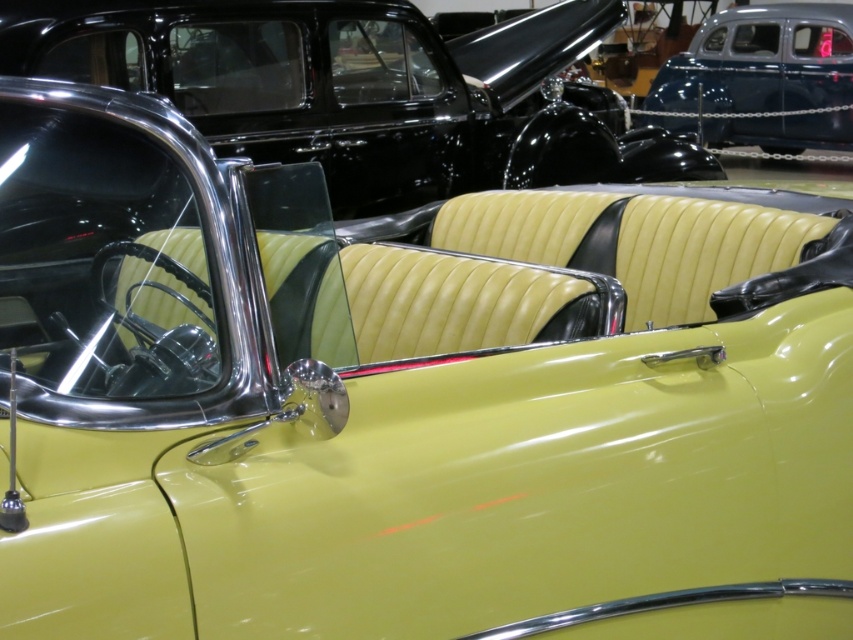
Question: Which point is farther to the camera?

Choices:
 (A) matte yellow leather car at center
 (B) matte blue car at upper right

Answer: (B)

Question: Can you confirm if matte yellow leather car at center is bigger than matte blue car at upper right?

Choices:
 (A) no
 (B) yes

Answer: (B)

Question: Which point is farther from the camera taking this photo?

Choices:
 (A) (706, 33)
 (B) (576, 26)

Answer: (A)

Question: Does matte yellow leather car at center appear over matte blue car at upper right?

Choices:
 (A) no
 (B) yes

Answer: (A)

Question: Observing the image, what is the correct spatial positioning of matte yellow leather car at center in reference to matte blue car at upper right?

Choices:
 (A) right
 (B) left

Answer: (B)

Question: Which of the following is the closest to the observer?

Choices:
 (A) matte blue car at upper right
 (B) matte yellow leather car at center

Answer: (B)